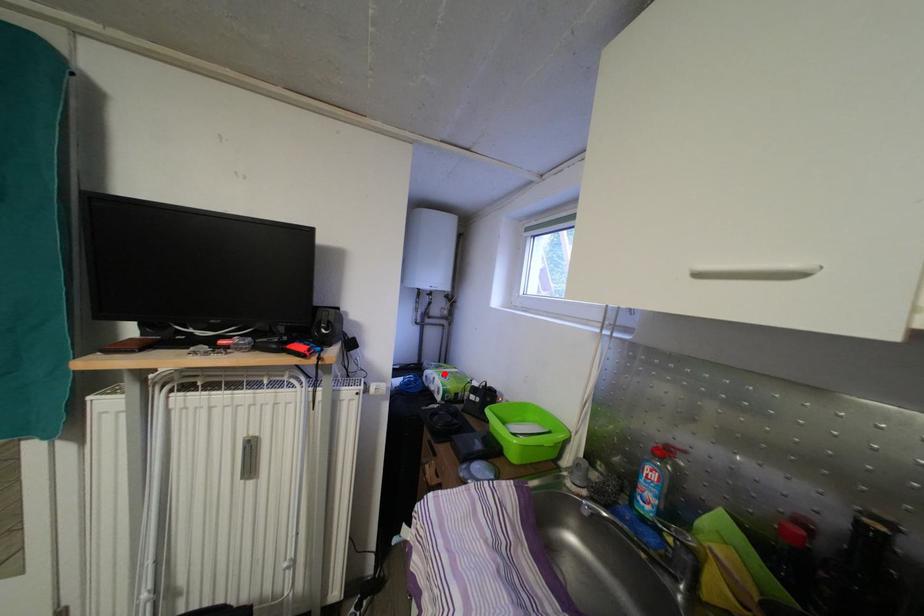
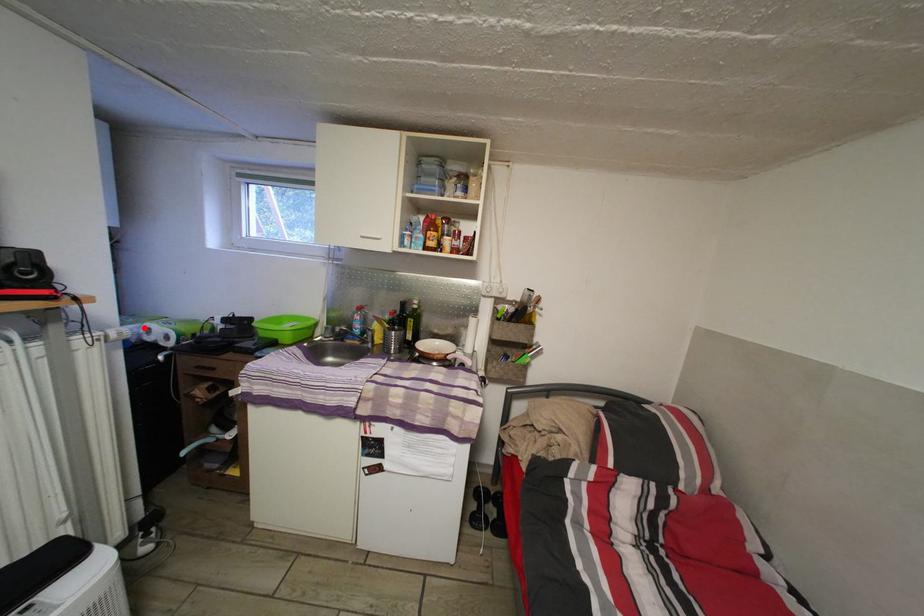
I am providing you with two images of the same scene from different viewpoints. A red point is marked on the first image and another point is marked on the second image. Is the marked point in image1 the same physical position as the marked point in image2?

Yes